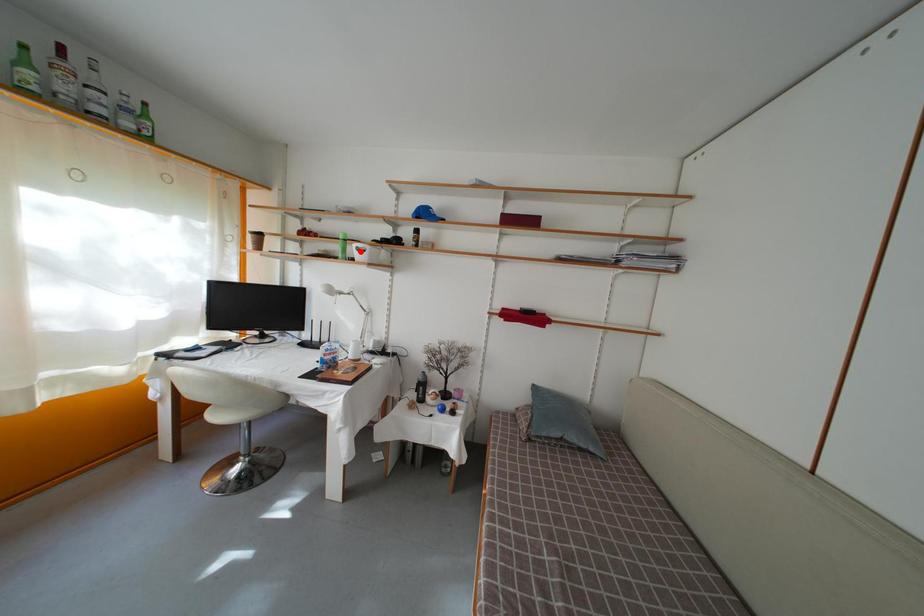
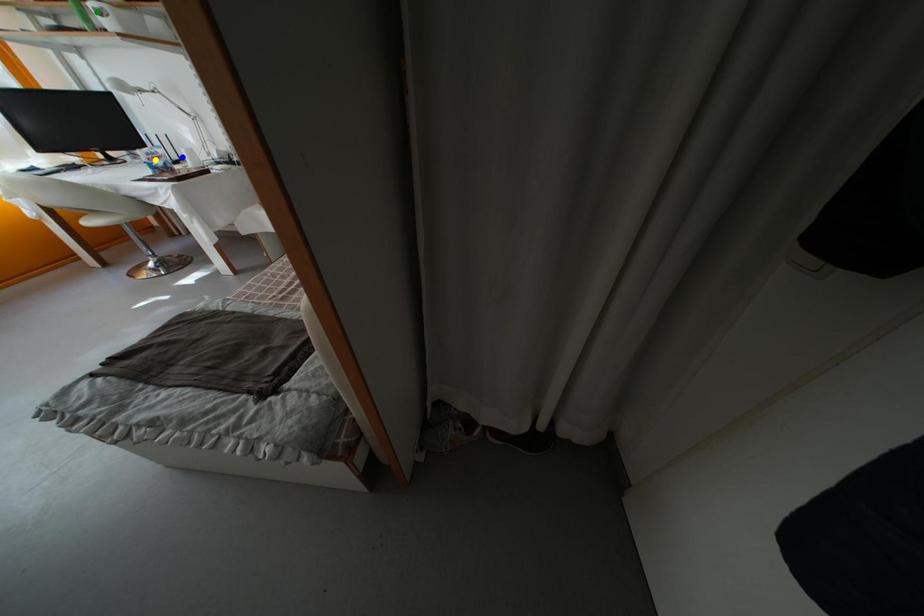
Question: I am providing you with two images of the same scene from different viewpoints. A red point is marked on the first image. You are given multiple points on the second image. Which point in image 2 represents the same 3d spot as the red point in image 1?

Choices:
 (A) yellow point
 (B) green point
 (C) blue point

Answer: (B)